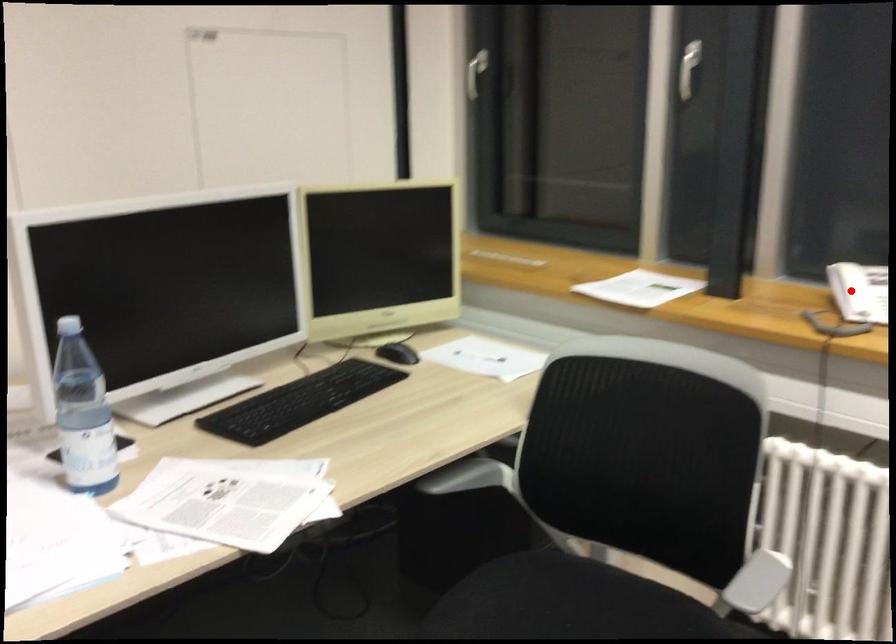
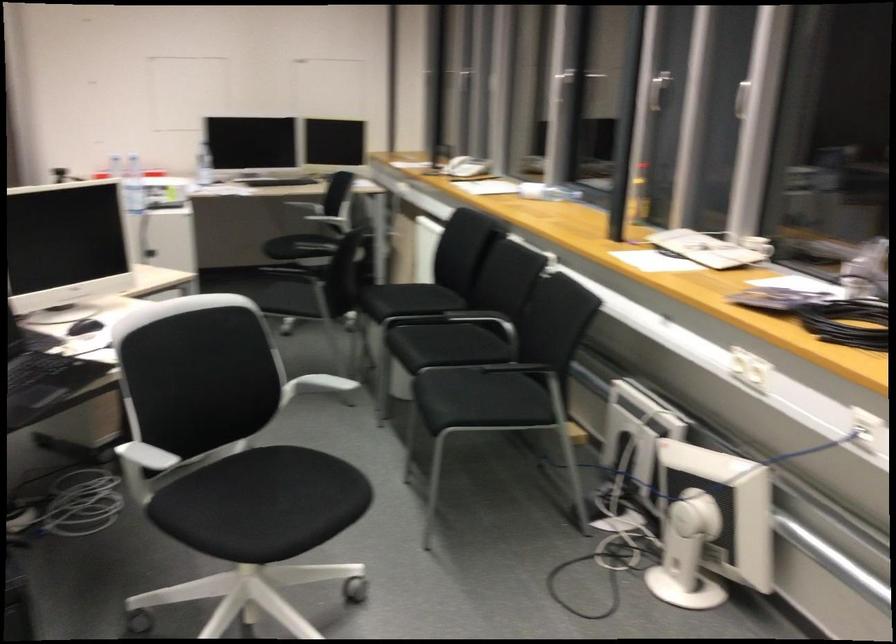
Question: I am providing you with two images of the same scene from different viewpoints. A red point is shown in image1. For the corresponding object point in image2, is it positioned nearer or farther from the camera?

Choices:
 (A) Nearer
 (B) Farther

Answer: (B)